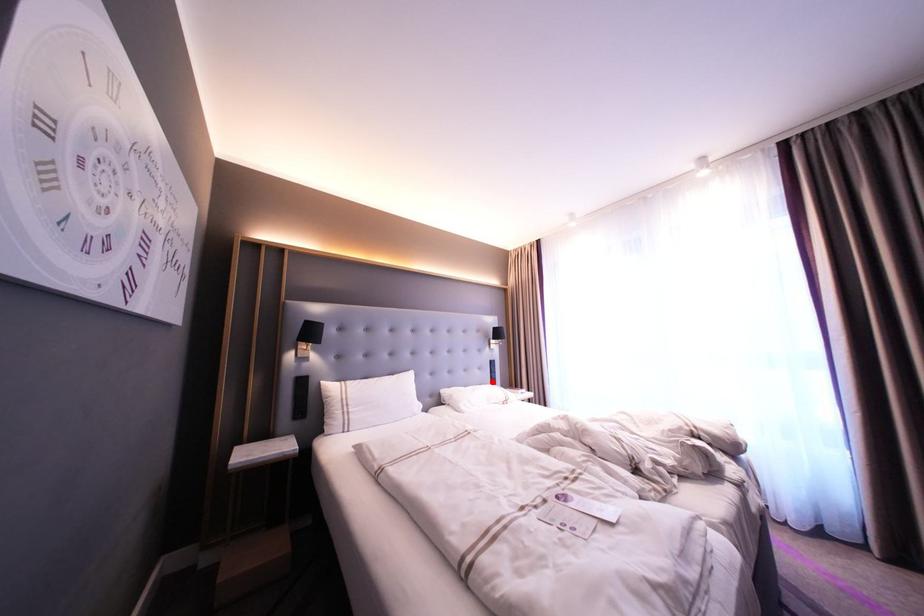
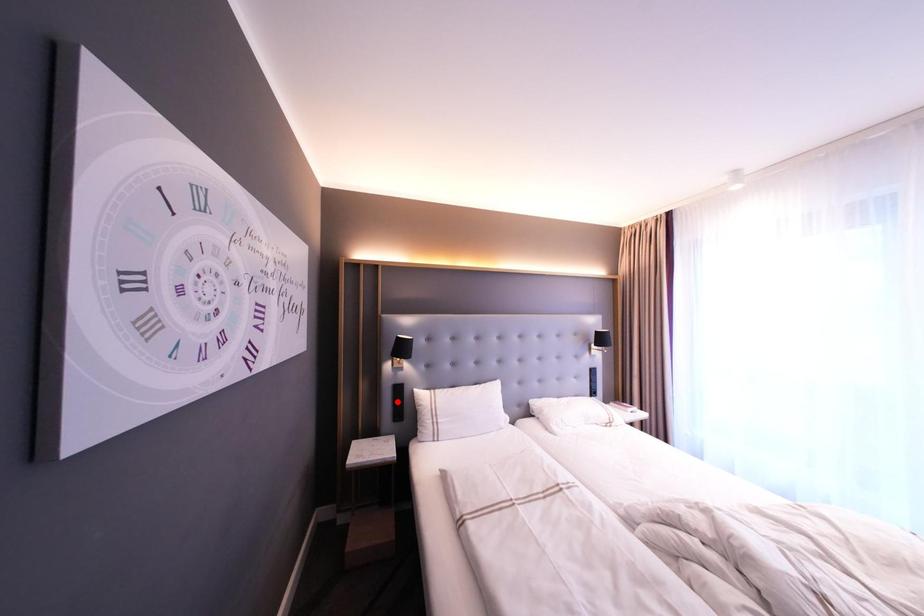
I am providing you with two images of the same scene from different viewpoints. A red point is marked on the first image and another point is marked on the second image. Is the red point in image1 aligned with the point shown in image2?

No